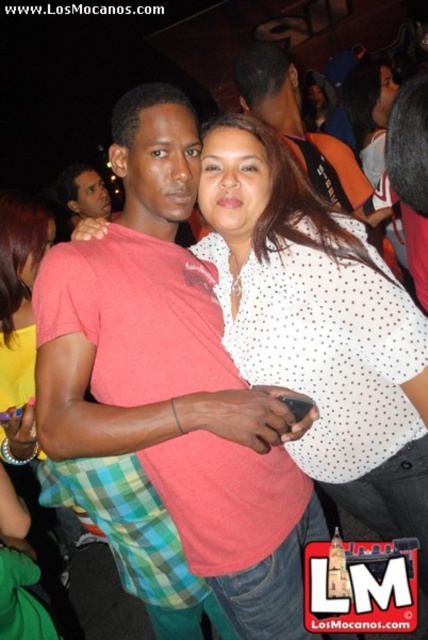
Question: Which object is closer to the camera taking this photo?

Choices:
 (A) yellow fabric shirt at left
 (B) pink cotton shirt at center

Answer: (B)

Question: Which point is farther to the camera?

Choices:
 (A) [x=50, y=228]
 (B) [x=109, y=208]
 (C) [x=329, y=134]
 (D) [x=186, y=397]

Answer: (B)

Question: Is yellow fabric shirt at left smaller than matte black shirt at upper left?

Choices:
 (A) yes
 (B) no

Answer: (A)

Question: Which object appears closest to the camera in this image?

Choices:
 (A) white dotted shirt at upper center
 (B) yellow fabric shirt at left
 (C) matte black shirt at upper left

Answer: (B)

Question: Does yellow fabric shirt at left appear under white dotted shirt at upper center?

Choices:
 (A) yes
 (B) no

Answer: (A)

Question: Can you confirm if yellow fabric shirt at left is bigger than white dotted shirt at upper center?

Choices:
 (A) no
 (B) yes

Answer: (A)